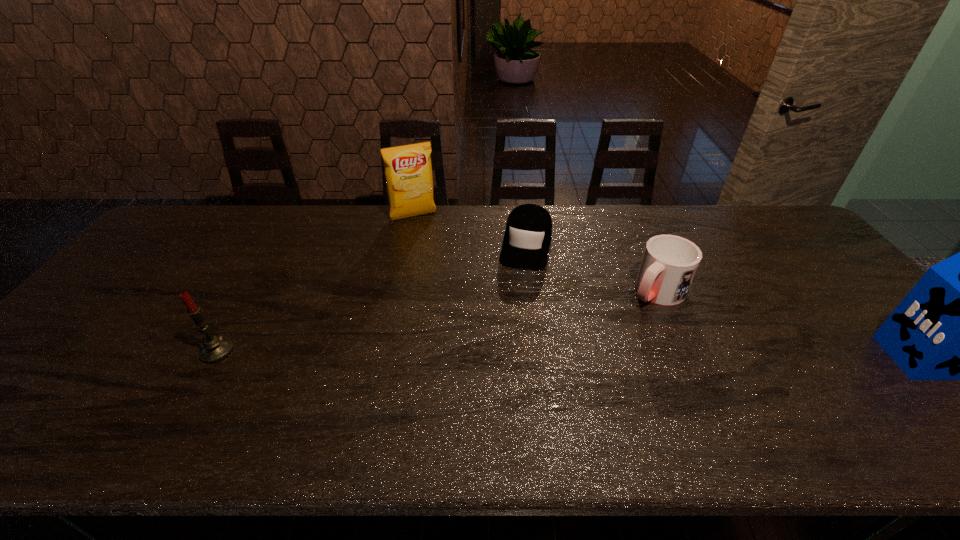
Locate an element on the screen. vacant area situated on the side of the second shortest object with the handle is located at coordinates (597, 345).

Identify the location of blank space located on the side of the second shortest object with the handle. (609, 334).

The height and width of the screenshot is (540, 960). Find the location of `vacant area situated on the front-facing side of the third object from left to right`. vacant area situated on the front-facing side of the third object from left to right is located at coordinates (502, 356).

This screenshot has height=540, width=960. In order to click on free space located 0.100m on the front-facing side of the third object from left to right in this screenshot , I will do `click(517, 293)`.

The image size is (960, 540). Identify the location of vacant space located 0.210m on the front-facing side of the third object from left to right. (511, 321).

Locate an element on the screen. Image resolution: width=960 pixels, height=540 pixels. vacant space situated on the front of the second tallest object with the logo is located at coordinates (427, 238).

Where is `vacant space located on the front of the second tallest object with the logo`? Image resolution: width=960 pixels, height=540 pixels. vacant space located on the front of the second tallest object with the logo is located at coordinates (451, 287).

What are the coordinates of `vacant space situated 0.370m on the front of the second tallest object with the logo` in the screenshot? It's located at (455, 293).

You are a GUI agent. You are given a task and a screenshot of the screen. Output one action in this format:
    pyautogui.click(x=<x>, y=<y>)
    Task: Click on the cap that is at the far edge
    This screenshot has width=960, height=540.
    Given the screenshot: What is the action you would take?
    pyautogui.click(x=527, y=238)

Find the location of a particular element. The height and width of the screenshot is (540, 960). crisp (potato chip) located at the far edge is located at coordinates click(x=408, y=171).